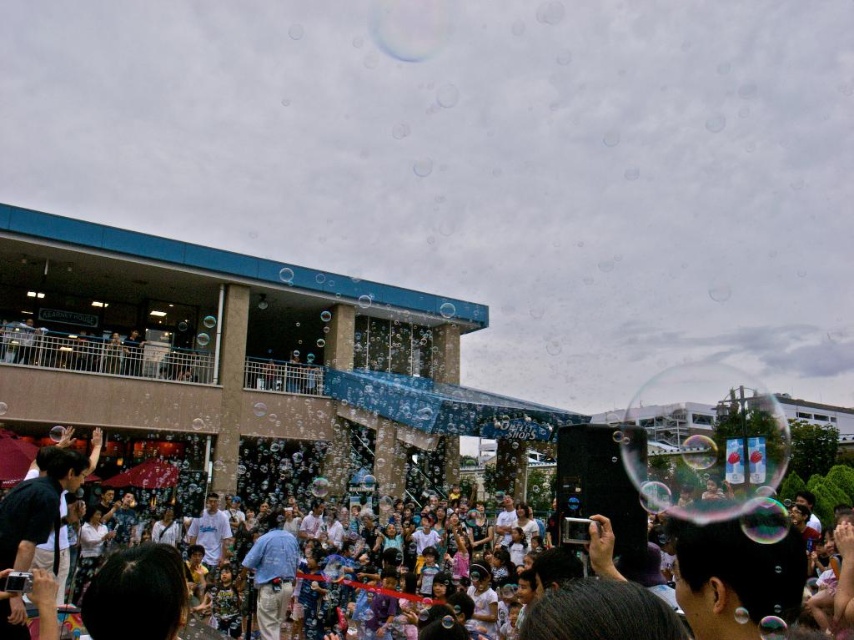
You are at the event and want to take a photo of the white cotton shirt at center. Where should you position yourself to capture it best?

To capture the white cotton shirt at center, position yourself at a point where you can focus on its coordinates at approximately 0.916 on the x and 0.799 on the y axis.

You are a photographer at the event and want to take a photo of the white cotton shirt at center and blue denim jeans at center. The camera you have can focus on objects within a 30 feet range. Will both subjects be in focus if you position yourself equidistant from both?

The white cotton shirt at center and blue denim jeans at center are 40.77 feet apart from each other. Since the camera can only focus within a 30 feet range, positioning yourself equidistant would mean each subject is 20.385 feet away from the camera. Both distances are within the 30 feet range, so yes, both will be in focus.

You are at the center of the event and notice two people wearing a white cotton shirt at center and blue denim jeans at center. If you want to take a photo of both, which one should you position to your left to include both in the frame?

You should position the blue denim jeans at center to your left since the white cotton shirt at center is to the right of the blue denim jeans at center, so placing the blue denim jeans at center on your left will keep both in the frame.